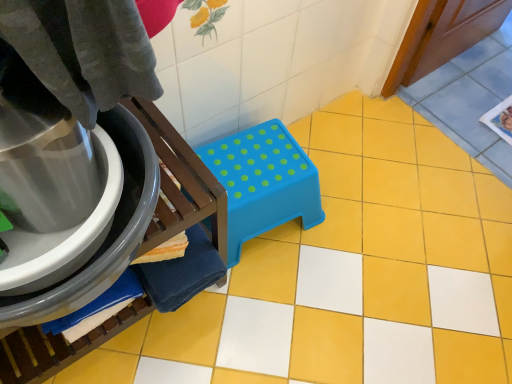
Image resolution: width=512 pixels, height=384 pixels. In order to click on free location in front of blue plastic step stool at center in this screenshot , I will do `click(268, 322)`.